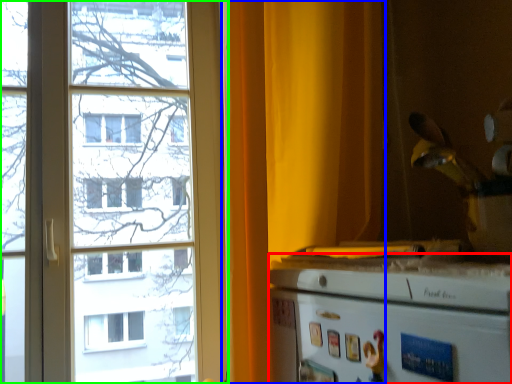
Question: Considering the real-world distances, which object is closest to appliance (highlighted by a red box)? curtain (highlighted by a blue box) or window (highlighted by a green box).

Choices:
 (A) curtain
 (B) window

Answer: (A)